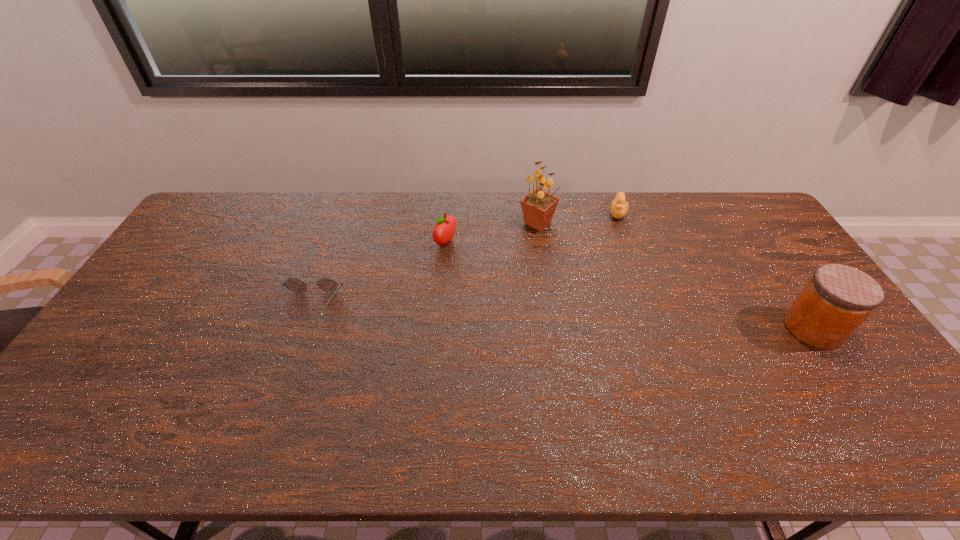
In order to click on vacant space on the desktop that is between the leftmost object and the fourth shortest object and is positioned on the face of the duckling in this screenshot , I will do `click(605, 320)`.

The width and height of the screenshot is (960, 540). I want to click on vacant space on the desktop that is between the leftmost object and the second tallest object and is positioned on the front-facing side of the apple, so click(592, 319).

At what (x,y) coordinates should I click in order to perform the action: click on vacant spot on the desktop that is between the spectacles and the second tallest object and is positioned at the front of the third object from left to right with flowers visible. Please return your answer as a coordinate pair (x, y). The image size is (960, 540). Looking at the image, I should click on (571, 318).